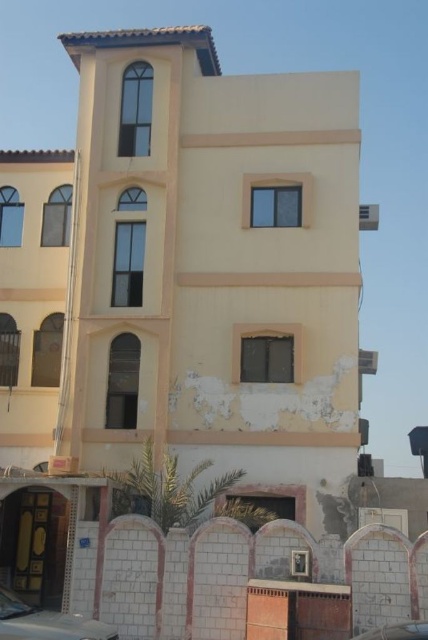
Question: Is metallic silver car at lower left closer to the viewer compared to metallic silver car at lower center?

Choices:
 (A) no
 (B) yes

Answer: (A)

Question: From the image, what is the correct spatial relationship of metallic silver car at lower left in relation to metallic silver car at lower center?

Choices:
 (A) left
 (B) right

Answer: (A)

Question: Which point appears closest to the camera in this image?

Choices:
 (A) (392, 634)
 (B) (59, 624)

Answer: (A)

Question: Considering the relative positions of metallic silver car at lower left and metallic silver car at lower center in the image provided, where is metallic silver car at lower left located with respect to metallic silver car at lower center?

Choices:
 (A) left
 (B) right

Answer: (A)